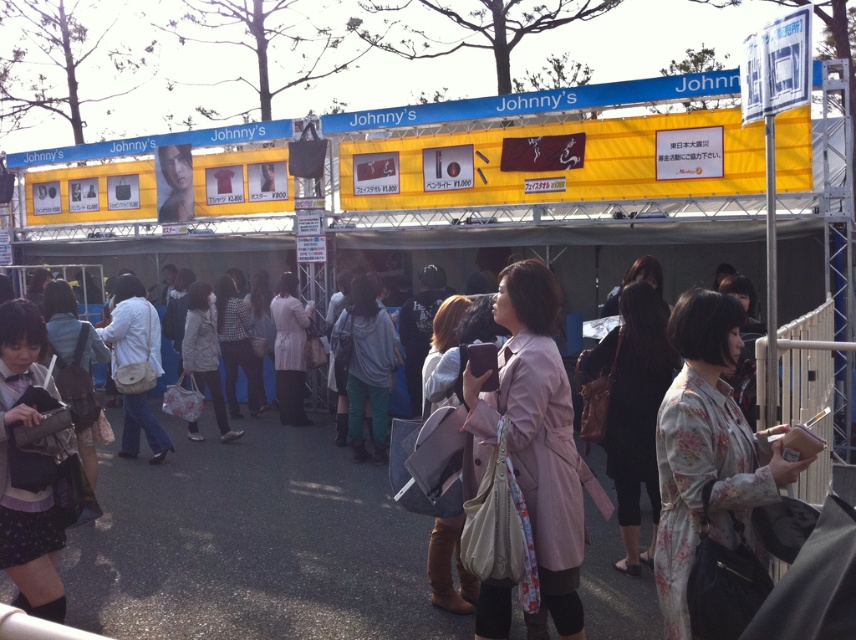
Does floral-patterned fabric at center have a smaller size compared to pink fabric coat at center?

Yes.

Describe the element at coordinates (706, 456) in the screenshot. I see `floral-patterned fabric at center` at that location.

What are the coordinates of `floral-patterned fabric at center` in the screenshot? It's located at (706, 456).